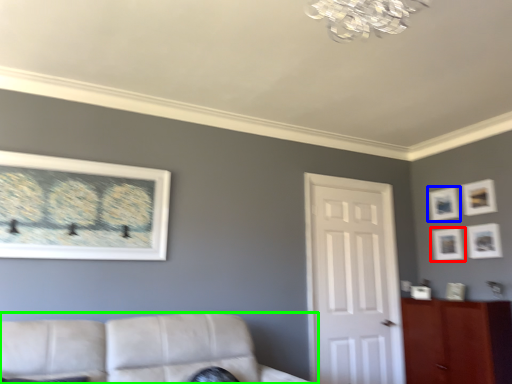
Question: Estimate the real-world distances between objects in this image. Which object is closer to picture frame (highlighted by a red box), picture frame (highlighted by a blue box) or studio couch (highlighted by a green box)?

Choices:
 (A) picture frame
 (B) studio couch

Answer: (A)